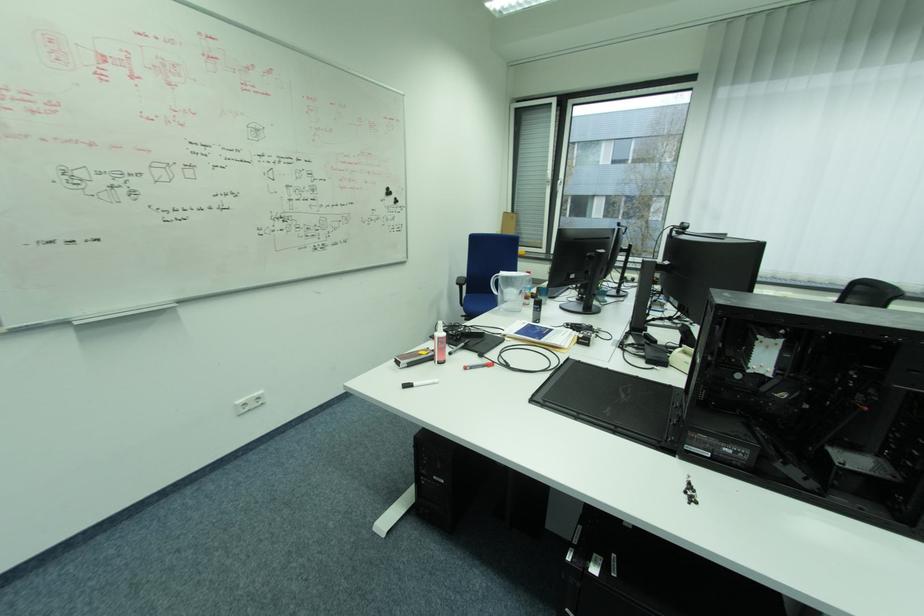
Image resolution: width=924 pixels, height=616 pixels. Describe the element at coordinates (244, 405) in the screenshot. I see `a white power socket` at that location.